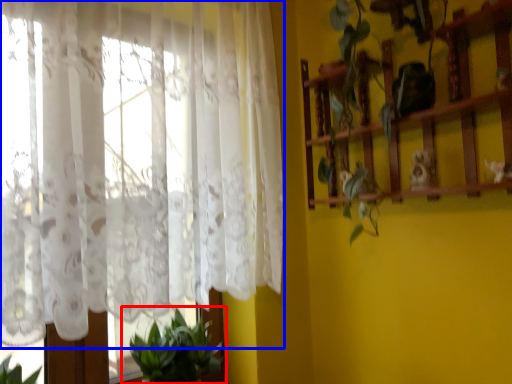
Question: Which object appears farthest to the camera in this image, houseplant (highlighted by a red box) or curtain (highlighted by a blue box)?

Choices:
 (A) houseplant
 (B) curtain

Answer: (A)